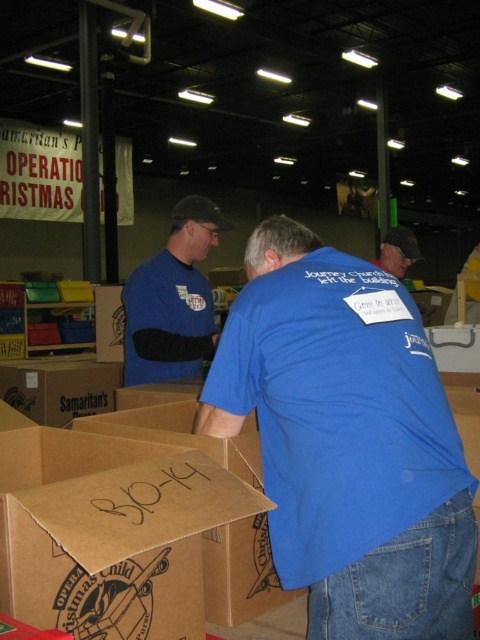
Question: Can you confirm if blue cotton shirt at center is positioned to the left of blue fabric shirt at center?

Choices:
 (A) no
 (B) yes

Answer: (A)

Question: Is blue cotton shirt at center in front of blue fabric shirt at center?

Choices:
 (A) no
 (B) yes

Answer: (B)

Question: Which point is closer to the camera?

Choices:
 (A) (250, 259)
 (B) (136, 376)

Answer: (A)

Question: Which object appears closest to the camera in this image?

Choices:
 (A) blue fabric shirt at center
 (B) blue cotton shirt at center

Answer: (B)

Question: Does blue cotton shirt at center appear over blue fabric shirt at center?

Choices:
 (A) no
 (B) yes

Answer: (A)